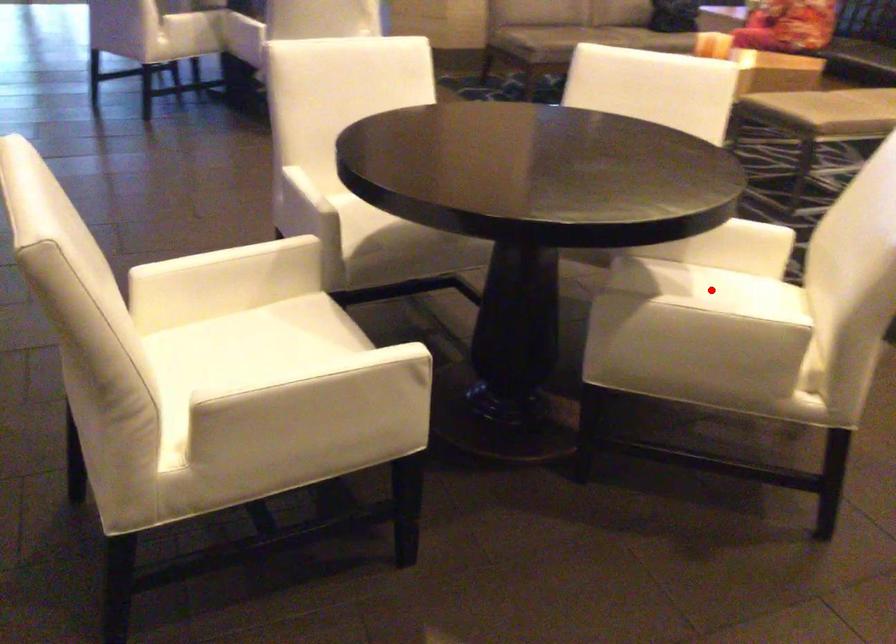
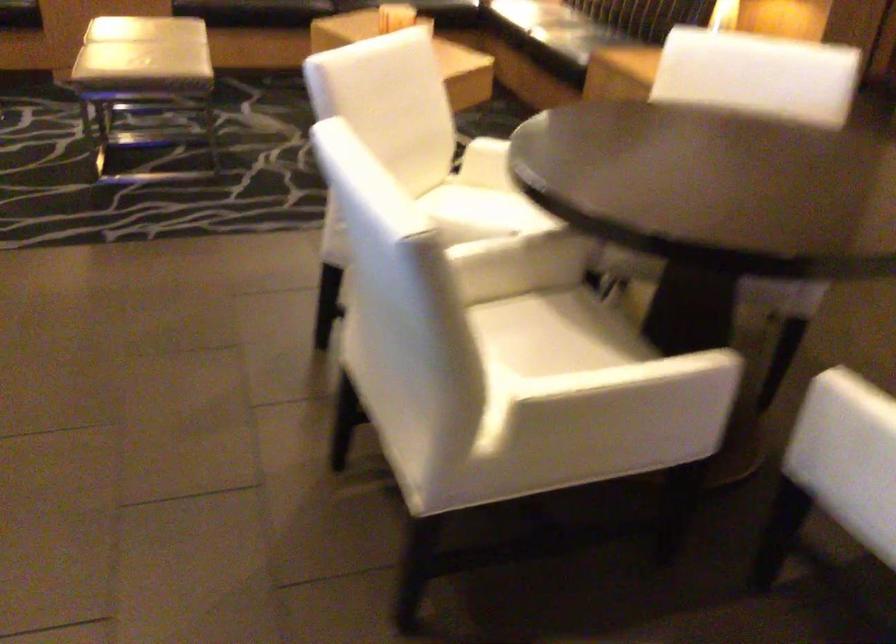
Question: I am providing you with two images of the same scene from different viewpoints. A red point is marked on the first image. Can you still see the location of the red point in image 2?

Choices:
 (A) Yes
 (B) No

Answer: (B)